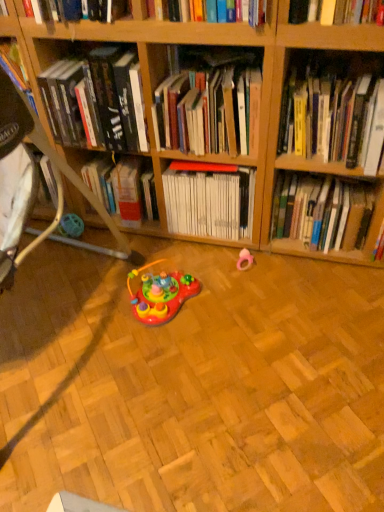
Question: Considering the relative sizes of hardcover book at center, marked as the fifth book in a left-to-right arrangement, and hardcover book at upper center, the 5th book when ordered from right to left, in the image provided, is hardcover book at center, marked as the fifth book in a left-to-right arrangement, bigger than hardcover book at upper center, the 5th book when ordered from right to left,?

Choices:
 (A) yes
 (B) no

Answer: (A)

Question: Does hardcover book at center, which is the 1th book in right-to-left order, have a greater width compared to hardcover book at upper center, the 1th book in the left-to-right sequence?

Choices:
 (A) no
 (B) yes

Answer: (A)

Question: Can you confirm if hardcover book at center, which is the 1th book in right-to-left order, is thinner than hardcover book at upper center, the 1th book in the left-to-right sequence?

Choices:
 (A) no
 (B) yes

Answer: (B)

Question: Are hardcover book at center, which is the 1th book in right-to-left order, and hardcover book at upper center, the 1th book in the left-to-right sequence, located far from each other?

Choices:
 (A) no
 (B) yes

Answer: (A)

Question: Is hardcover book at center, which is the 1th book in right-to-left order, positioned beyond the bounds of hardcover book at upper center, the 1th book in the left-to-right sequence?

Choices:
 (A) yes
 (B) no

Answer: (A)

Question: From the image's perspective, is white matte book at center, which appears as the third book when viewed from the left, located above or below hardcover books at center, the 4th book from the right?

Choices:
 (A) above
 (B) below

Answer: (B)

Question: Which is correct: white matte book at center, which is the 3th book in right-to-left order, is inside hardcover books at center, the 4th book from the right, or outside of it?

Choices:
 (A) outside
 (B) inside

Answer: (A)

Question: In the image, is white matte book at center, which is the 3th book in right-to-left order, positioned in front of or behind hardcover books at center, positioned as the second book in left-to-right order?

Choices:
 (A) front
 (B) behind

Answer: (B)

Question: Considering the positions of white matte book at center, which appears as the third book when viewed from the left, and hardcover books at center, positioned as the second book in left-to-right order, in the image, is white matte book at center, which appears as the third book when viewed from the left, taller or shorter than hardcover books at center, positioned as the second book in left-to-right order,?

Choices:
 (A) short
 (B) tall

Answer: (B)

Question: From the image's perspective, is hardcover book at center, marked as the fifth book in a left-to-right arrangement, above or below white matte book at center, which is the 3th book in right-to-left order?

Choices:
 (A) below
 (B) above

Answer: (A)

Question: In terms of height, does hardcover book at center, which is the 1th book in right-to-left order, look taller or shorter compared to white matte book at center, which is the 3th book in right-to-left order?

Choices:
 (A) short
 (B) tall

Answer: (B)

Question: Would you say hardcover book at center, which is the 1th book in right-to-left order, is inside or outside white matte book at center, which appears as the third book when viewed from the left?

Choices:
 (A) outside
 (B) inside

Answer: (A)

Question: From a real-world perspective, relative to white matte book at center, which appears as the third book when viewed from the left, is hardcover book at center, which is the 1th book in right-to-left order, vertically above or below?

Choices:
 (A) below
 (B) above

Answer: (B)

Question: Considering the positions of yellow hardcover book at upper right, the 2th book positioned from the right, and hardcover books at center, the 4th book from the right, in the image, is yellow hardcover book at upper right, the 2th book positioned from the right, bigger or smaller than hardcover books at center, the 4th book from the right,?

Choices:
 (A) big
 (B) small

Answer: (A)

Question: Looking at their shapes, would you say yellow hardcover book at upper right, the 2th book positioned from the right, is wider or thinner than hardcover books at center, the 4th book from the right?

Choices:
 (A) wide
 (B) thin

Answer: (A)